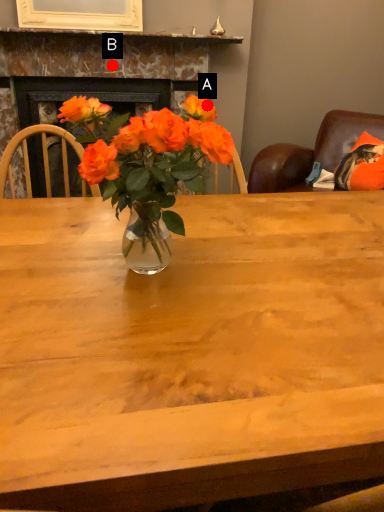
Question: Two points are circled on the image, labeled by A and B beside each circle. Which of the following is the closest to the observer?

Choices:
 (A) A is closer
 (B) B is closer

Answer: (A)